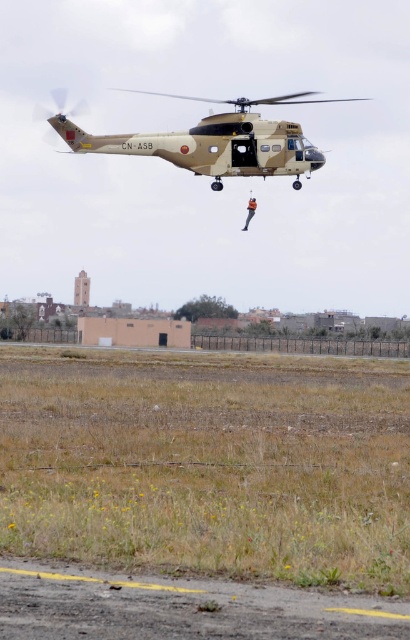
Question: Where is dark gray asphalt runway at lower center located in relation to camouflage fabric helicopter at center in the image?

Choices:
 (A) left
 (B) right

Answer: (A)

Question: Is dark gray asphalt runway at lower center thinner than camouflage fabric helicopter at center?

Choices:
 (A) yes
 (B) no

Answer: (A)

Question: Which point is farther to the camera?

Choices:
 (A) (107, 582)
 (B) (250, 144)

Answer: (B)

Question: Does dark gray asphalt runway at lower center have a larger size compared to camouflage fabric helicopter at center?

Choices:
 (A) yes
 (B) no

Answer: (B)

Question: Which point appears farthest from the camera in this image?

Choices:
 (A) (218, 134)
 (B) (66, 595)

Answer: (A)